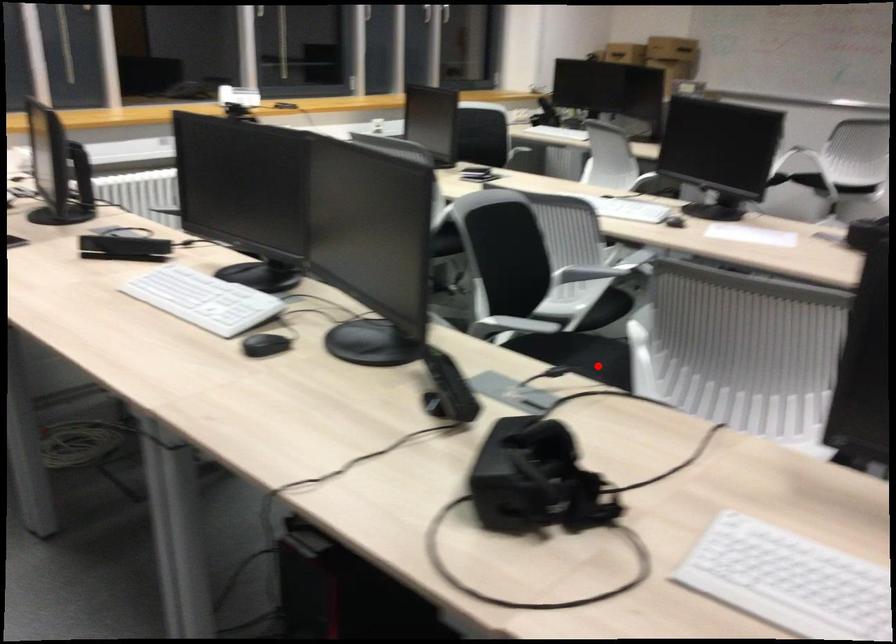
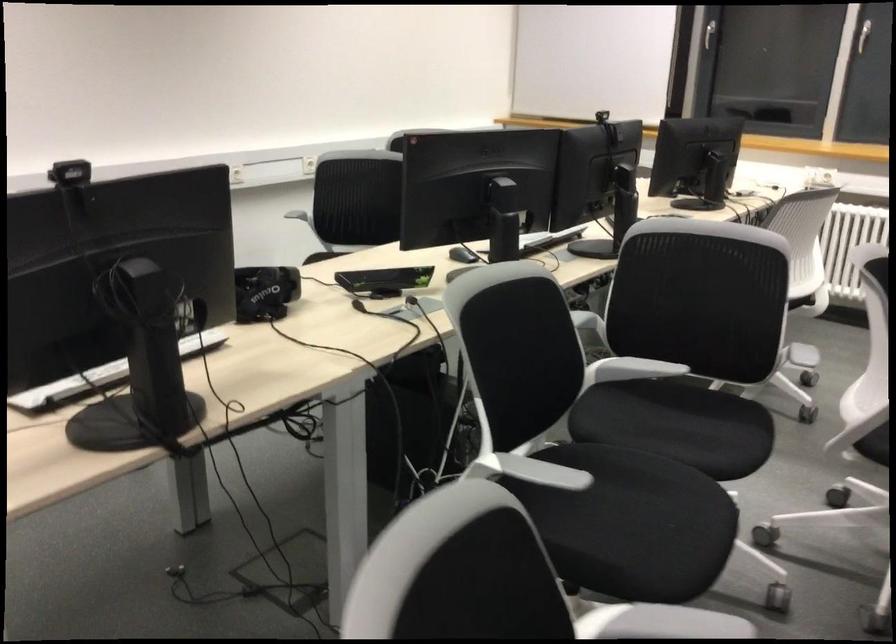
Find the pixel in the second image that matches the highlighted location in the first image.

(676, 424)